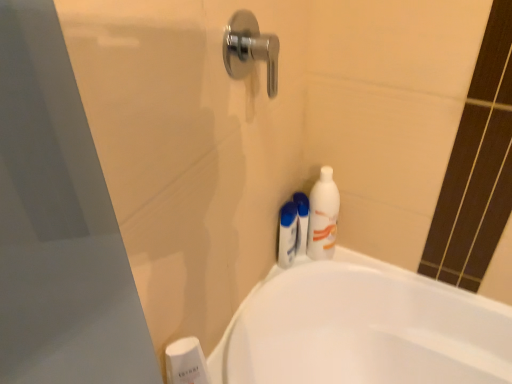
Question: Should I look upward or downward to see white glossy bathtub at lower right?

Choices:
 (A) up
 (B) down

Answer: (B)

Question: Is there a large distance between chrome metallic door handle at upper center and white glossy bathtub at lower right?

Choices:
 (A) yes
 (B) no

Answer: (B)

Question: Can white glossy bathtub at lower right be found inside chrome metallic door handle at upper center?

Choices:
 (A) no
 (B) yes

Answer: (A)

Question: Does chrome metallic door handle at upper center have a greater width compared to white glossy bathtub at lower right?

Choices:
 (A) no
 (B) yes

Answer: (A)

Question: Is chrome metallic door handle at upper center thinner than white glossy bathtub at lower right?

Choices:
 (A) yes
 (B) no

Answer: (A)

Question: Is chrome metallic door handle at upper center closer to the viewer compared to white glossy bathtub at lower right?

Choices:
 (A) no
 (B) yes

Answer: (B)

Question: Is chrome metallic door handle at upper center turned away from white glossy bathtub at lower right?

Choices:
 (A) no
 (B) yes

Answer: (A)

Question: Does white glossy bathtub at lower right have a smaller size compared to white plastic shampoo bottle at upper center, which is the first toiletry from right to left?

Choices:
 (A) no
 (B) yes

Answer: (A)

Question: From the image's perspective, is white glossy bathtub at lower right on top of white plastic shampoo bottle at upper center, which is the first toiletry from right to left?

Choices:
 (A) no
 (B) yes

Answer: (A)

Question: Is white glossy bathtub at lower right wider than white plastic shampoo bottle at upper center, which is the first toiletry from right to left?

Choices:
 (A) no
 (B) yes

Answer: (B)

Question: Does white glossy bathtub at lower right appear on the left side of white plastic shampoo bottle at upper center, the 2th toiletry ordered from the bottom?

Choices:
 (A) yes
 (B) no

Answer: (B)

Question: From a real-world perspective, does white glossy bathtub at lower right stand above white plastic shampoo bottle at upper center, which is the first toiletry from right to left?

Choices:
 (A) no
 (B) yes

Answer: (A)

Question: Can you confirm if white glossy bathtub at lower right is bigger than white plastic shampoo bottle at upper center, which is the second toiletry from left to right?

Choices:
 (A) yes
 (B) no

Answer: (A)

Question: Is white glossy bathtub at lower right outside of white plastic soap dispenser at lower left, arranged as the 1th toiletry when viewed from the front?

Choices:
 (A) yes
 (B) no

Answer: (A)